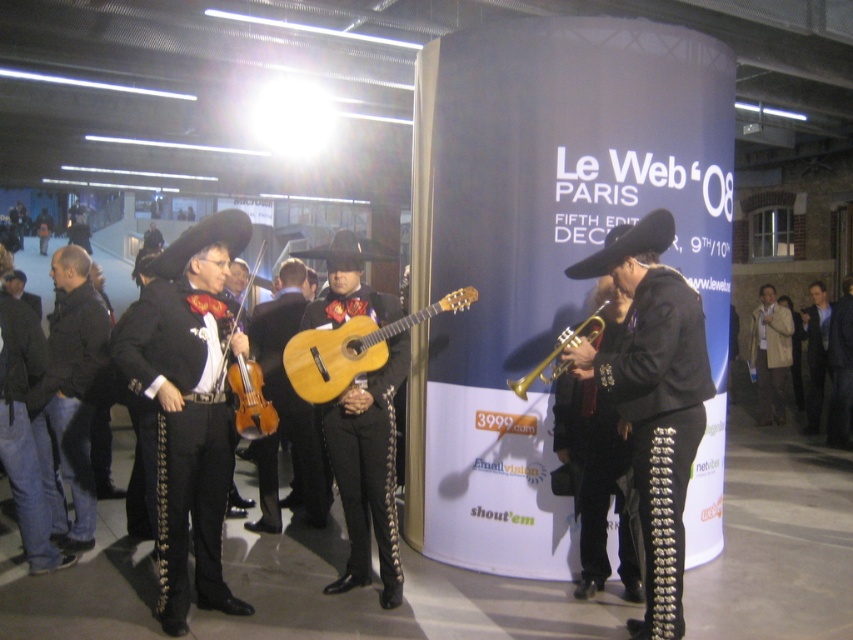
You are a photographer standing in front of the stage where the mariachi band is performing. You want to take a photo that includes both the matte wood guitar at center and the matte black violin at center. What is the minimum distance you need to step back to ensure both instruments are fully visible in your photo?

The matte wood guitar at center and the matte black violin at center are 3.40 feet apart from each other. To capture both instruments in a single frame, you should step back at least 3.40 feet to ensure they are fully visible.

You are organizing a photo shoot and need to ensure that the black leather pants at right and the wooden violin at left are both visible in the frame. Given that the camera can only capture objects up to the width of the wider object, will both items fit within the camera frame?

The black leather pants at right are wider than the wooden violin at left. Since the camera can capture up to the width of the wider object, both items will fit within the camera frame as the camera can accommodate the width of the black leather pants at right.

Based on the scene description, where is the matte black mariachi outfit at left located in the image?

The matte black mariachi outfit at left is located at point 0.634 on the x axis and 0.220 on the y axis.